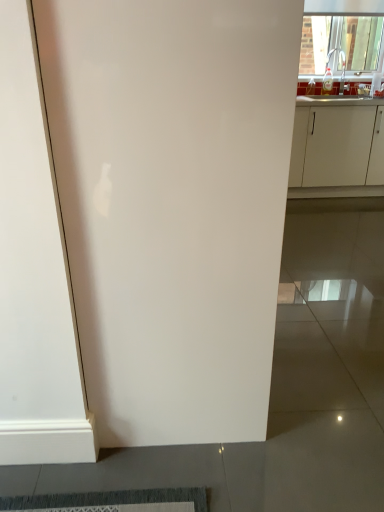
Question: From the image's perspective, does transparent glass window at upper right appear higher than white glossy door at center?

Choices:
 (A) yes
 (B) no

Answer: (A)

Question: Is transparent glass window at upper right at the left side of white glossy door at center?

Choices:
 (A) yes
 (B) no

Answer: (B)

Question: Is transparent glass window at upper right not inside white glossy door at center?

Choices:
 (A) yes
 (B) no

Answer: (A)

Question: Can you confirm if transparent glass window at upper right is shorter than white glossy door at center?

Choices:
 (A) no
 (B) yes

Answer: (B)

Question: Is transparent glass window at upper right thinner than white glossy door at center?

Choices:
 (A) no
 (B) yes

Answer: (B)

Question: Considering the relative positions of transparent glass window at upper right and white glossy door at center in the image provided, is transparent glass window at upper right in front of white glossy door at center?

Choices:
 (A) yes
 (B) no

Answer: (B)

Question: From a real-world perspective, is transparent glass window at upper right below white matte cabinet at right?

Choices:
 (A) no
 (B) yes

Answer: (A)

Question: Considering the relative positions of transparent glass window at upper right and white matte cabinet at right in the image provided, is transparent glass window at upper right to the left of white matte cabinet at right from the viewer's perspective?

Choices:
 (A) no
 (B) yes

Answer: (A)

Question: Does transparent glass window at upper right have a smaller size compared to white matte cabinet at right?

Choices:
 (A) yes
 (B) no

Answer: (A)

Question: Are transparent glass window at upper right and white matte cabinet at right beside each other?

Choices:
 (A) no
 (B) yes

Answer: (A)

Question: Is transparent glass window at upper right oriented away from white matte cabinet at right?

Choices:
 (A) no
 (B) yes

Answer: (A)

Question: Does transparent glass window at upper right have a lesser width compared to white matte cabinet at right?

Choices:
 (A) yes
 (B) no

Answer: (A)

Question: Is white matte cabinet at right not near transparent glass window at upper right?

Choices:
 (A) no
 (B) yes

Answer: (B)